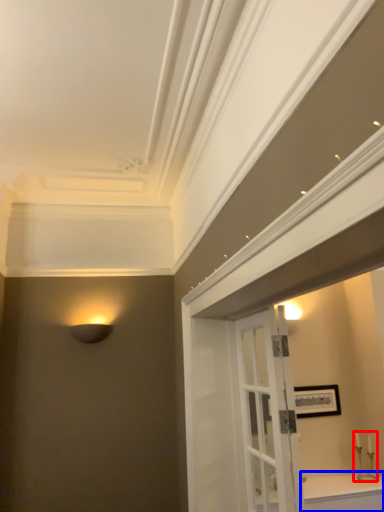
Question: Which point is further to the camera, candle holder (highlighted by a red box) or cabinetry (highlighted by a blue box)?

Choices:
 (A) candle holder
 (B) cabinetry

Answer: (A)